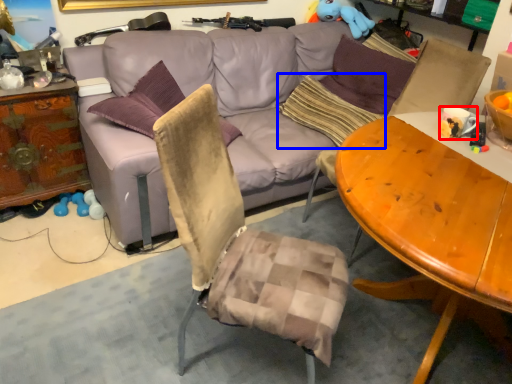
Question: Which of the following is the farthest to the observer, coffee cup (highlighted by a red box) or pillow (highlighted by a blue box)?

Choices:
 (A) coffee cup
 (B) pillow

Answer: (B)